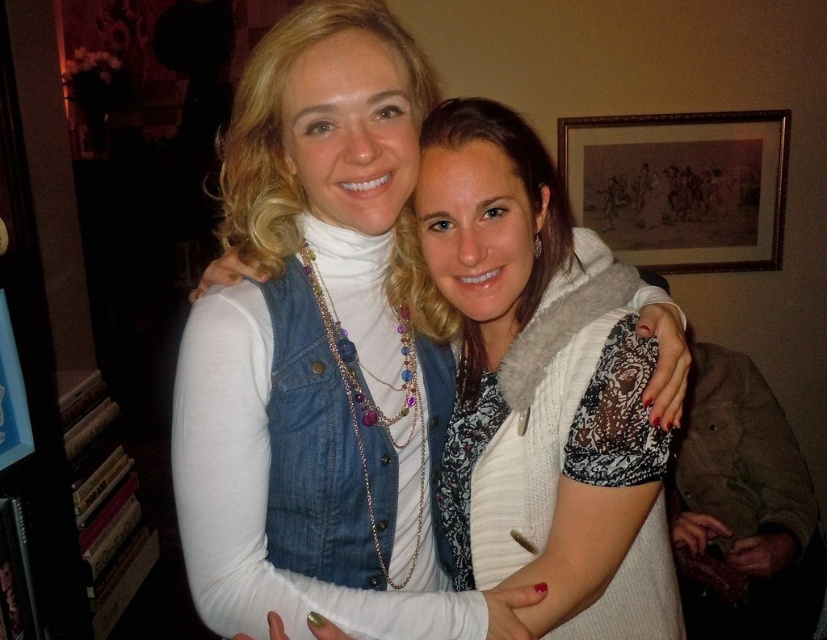
You are a fashion designer analyzing the image. You need to determine the exact location of the denim vest at center in the image. What are its coordinates?

The denim vest at center is located at coordinates point (318, 353).

You are an interior designer analyzing the layout of this room. You need to place a new decorative item between the denim vest at center and the wooden framed artwork at upper right. Based on their positions, which object should the new item be placed to the right of?

The new decorative item should be placed to the right of the denim vest at center because the denim vest at center is located to the left of the wooden framed artwork at upper right.

You are an interior designer assessing the layout of this room. The denim vest at center and the wooden framed artwork at upper right are both in view. Which object is positioned higher up in the image?

The denim vest at center is much taller than the wooden framed artwork at upper right, so it is positioned higher up in the image.